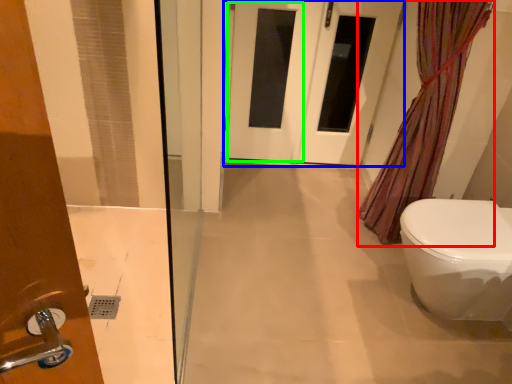
Question: Estimate the real-world distances between objects in this image. Which object is closer to shower curtain (highlighted by a red box), door (highlighted by a blue box) or screen door (highlighted by a green box)?

Choices:
 (A) door
 (B) screen door

Answer: (A)